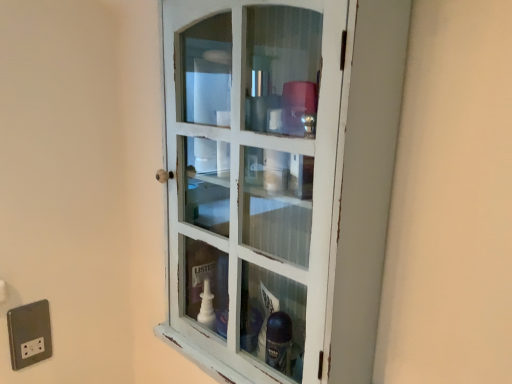
Question: Considering the positions of white distressed wood cabinet at center and silver metallic outlet at lower left in the image, is white distressed wood cabinet at center taller or shorter than silver metallic outlet at lower left?

Choices:
 (A) tall
 (B) short

Answer: (A)

Question: Considering their positions, is white distressed wood cabinet at center located in front of or behind silver metallic outlet at lower left?

Choices:
 (A) behind
 (B) front

Answer: (B)

Question: Visually, is white distressed wood cabinet at center positioned to the left or to the right of silver metallic outlet at lower left?

Choices:
 (A) left
 (B) right

Answer: (B)

Question: Is silver metallic outlet at lower left wider or thinner than white distressed wood cabinet at center?

Choices:
 (A) wide
 (B) thin

Answer: (B)

Question: Is silver metallic outlet at lower left spatially inside white distressed wood cabinet at center, or outside of it?

Choices:
 (A) inside
 (B) outside

Answer: (B)

Question: Is point (13, 344) closer or farther from the camera than point (169, 243)?

Choices:
 (A) farther
 (B) closer

Answer: (A)

Question: Is silver metallic outlet at lower left bigger or smaller than white distressed wood cabinet at center?

Choices:
 (A) small
 (B) big

Answer: (A)